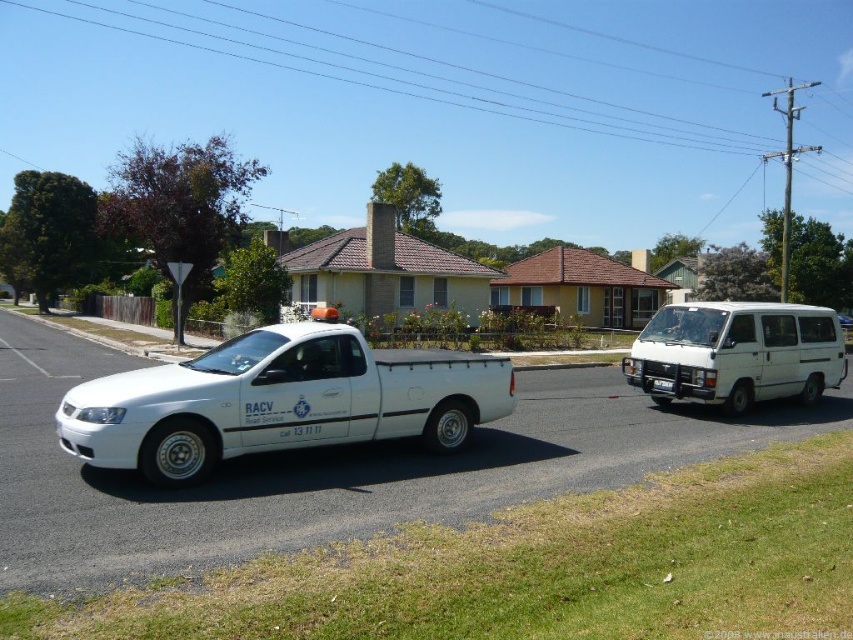
You are a delivery driver who needs to park your vehicle between the white matte pickup truck at center and the white matte van at right. Is there enough space between them for your car, which is 4.5 meters long?

The white matte pickup truck at center is to the left of the white matte van at right, but the distance between them isn not specified. Without knowing the exact spacing, I cannot confirm if there is sufficient room for your 4.5 meter car.

You are standing on the suburban street and want to determine which of the two points, point (461, 396) or point (729, 330), is nearer to you. Based on the scene description, which point is closer?

Point (461, 396) is closer to the viewer than point (729, 330).

You are a pedestrian standing at the edge of the road. You see the white matte pickup truck at center and the white matte van at right. Which vehicle is closer to you?

The white matte pickup truck at center is closer to you because it is in front of the white matte van at right.